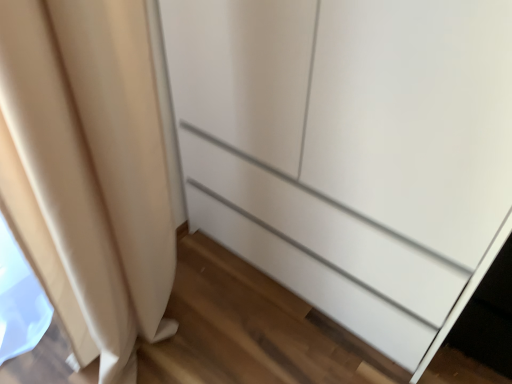
The image size is (512, 384). I want to click on white matte file cabinet at center, so pos(351,151).

This screenshot has width=512, height=384. Describe the element at coordinates (351, 151) in the screenshot. I see `white matte file cabinet at center` at that location.

This screenshot has width=512, height=384. Find the location of `white matte file cabinet at center`. white matte file cabinet at center is located at coordinates (351, 151).